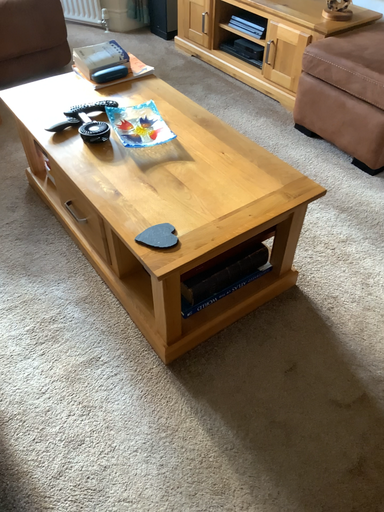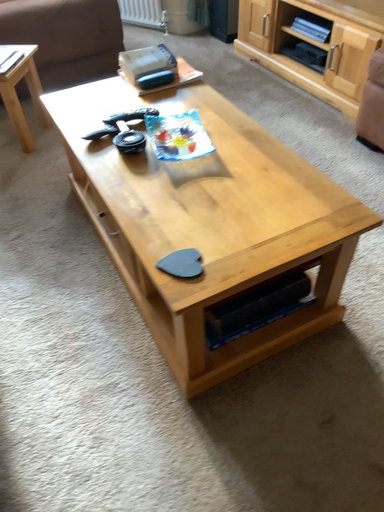
Question: Which way did the camera rotate in the video?

Choices:
 (A) rotated left
 (B) rotated right

Answer: (A)